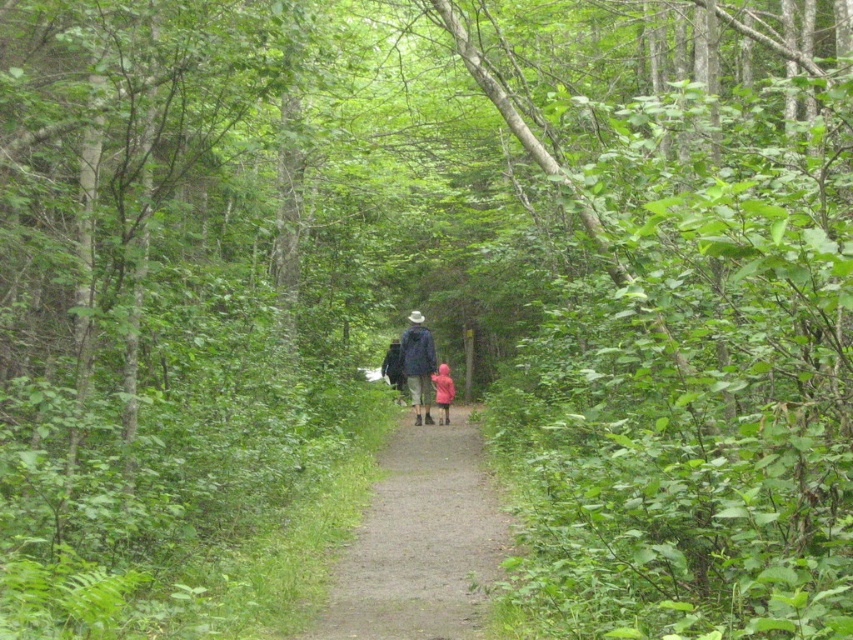
Question: Does dirt path at center have a greater width compared to pink matte jacket at center?

Choices:
 (A) yes
 (B) no

Answer: (A)

Question: Considering the real-world distances, which object is closest to the dirt path at center?

Choices:
 (A) dark blue jacket at center
 (B) pink matte jacket at center

Answer: (A)

Question: Which point appears closest to the camera in this image?

Choices:
 (A) (373, 532)
 (B) (416, 332)
 (C) (436, 400)

Answer: (A)

Question: Can you confirm if dirt path at center is positioned to the left of pink matte jacket at center?

Choices:
 (A) yes
 (B) no

Answer: (B)

Question: Which object is positioned closest to the dark blue jacket at center?

Choices:
 (A) dirt path at center
 (B) pink matte jacket at center

Answer: (B)

Question: Can you confirm if dark blue jacket at center is thinner than pink matte jacket at center?

Choices:
 (A) no
 (B) yes

Answer: (A)